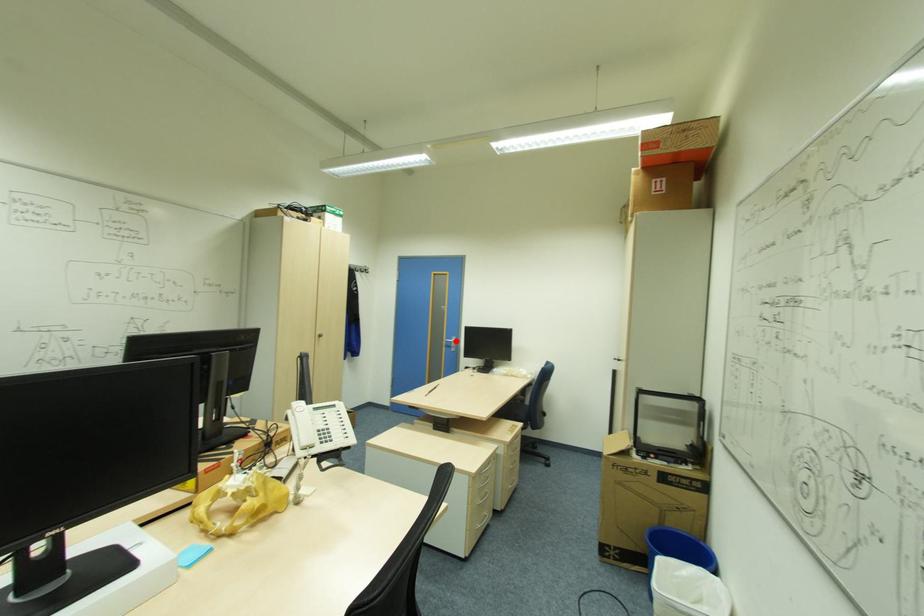
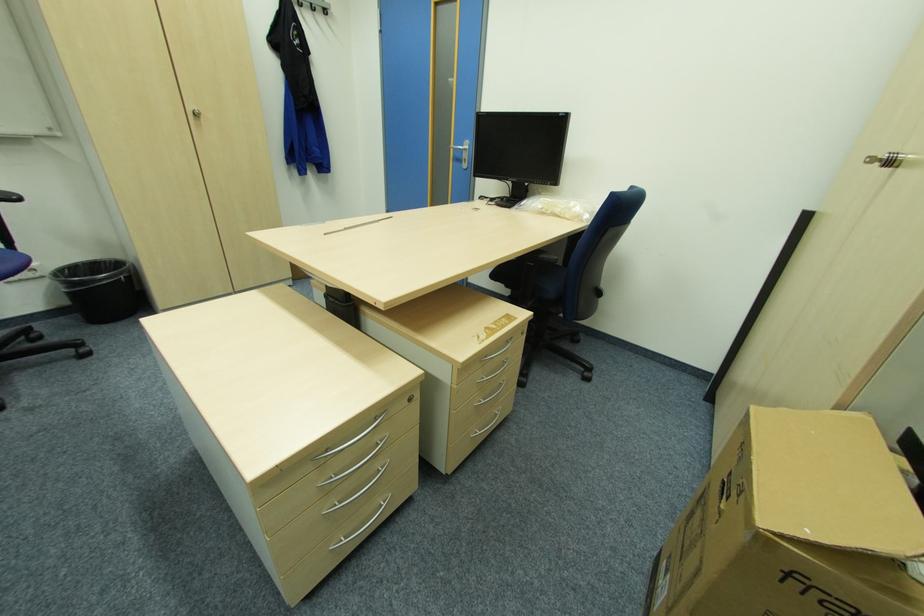
Where in the second image is the point corresponding to the highlighted location from the first image?

(468, 148)